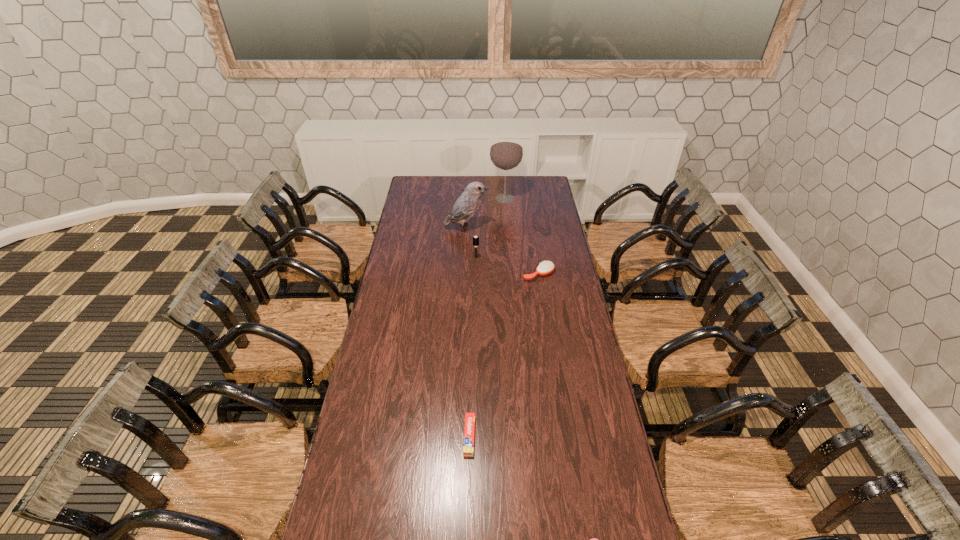
Image resolution: width=960 pixels, height=540 pixels. What are the coordinates of `vacant space positioned on the left of the alcohol` in the screenshot? It's located at (423, 199).

Find the location of `vacant area situated on the front-facing side of the parrot`. vacant area situated on the front-facing side of the parrot is located at coordinates (527, 228).

Where is `free space located 0.140m on the right of the tallest hairbrush`? free space located 0.140m on the right of the tallest hairbrush is located at coordinates (507, 258).

I want to click on vacant space located 0.230m on the back of the fourth tallest object, so click(533, 239).

The image size is (960, 540). In order to click on free location located on the left of the second nearest object in this screenshot , I will do `click(390, 436)`.

Find the location of a particular element. This screenshot has width=960, height=540. object that is positioned at the far edge is located at coordinates (506, 153).

Where is `object present at the right edge`? Image resolution: width=960 pixels, height=540 pixels. object present at the right edge is located at coordinates (546, 267).

You are a GUI agent. You are given a task and a screenshot of the screen. Output one action in this format:
    pyautogui.click(x=<x>, y=<y>)
    Task: Click on the vacant space at the far edge
    The image size is (960, 540).
    Given the screenshot: What is the action you would take?
    pyautogui.click(x=487, y=183)

In the image, there is a desktop. Where is `free space at the left edge`? free space at the left edge is located at coordinates [348, 489].

Identify the location of vacant space at the right edge of the desktop. (568, 397).